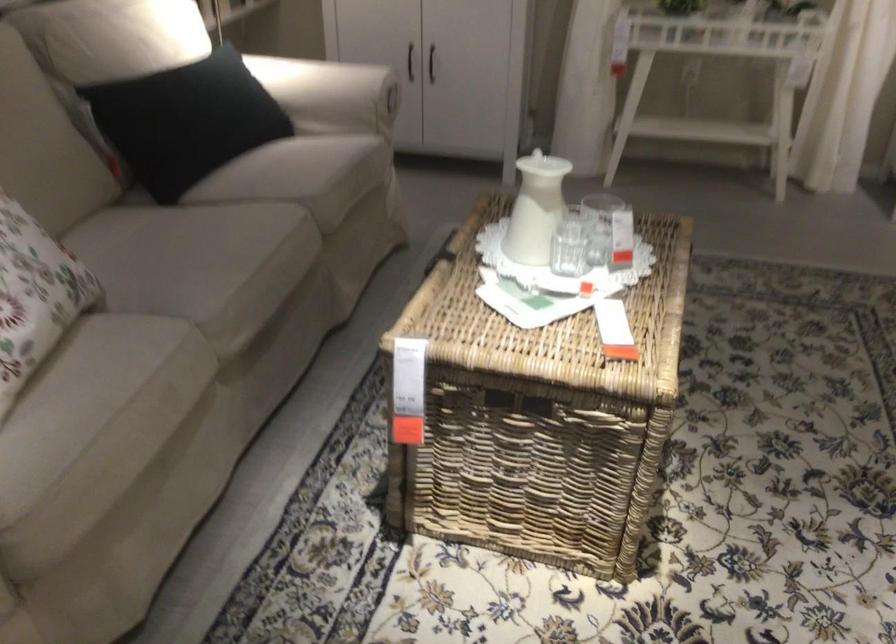
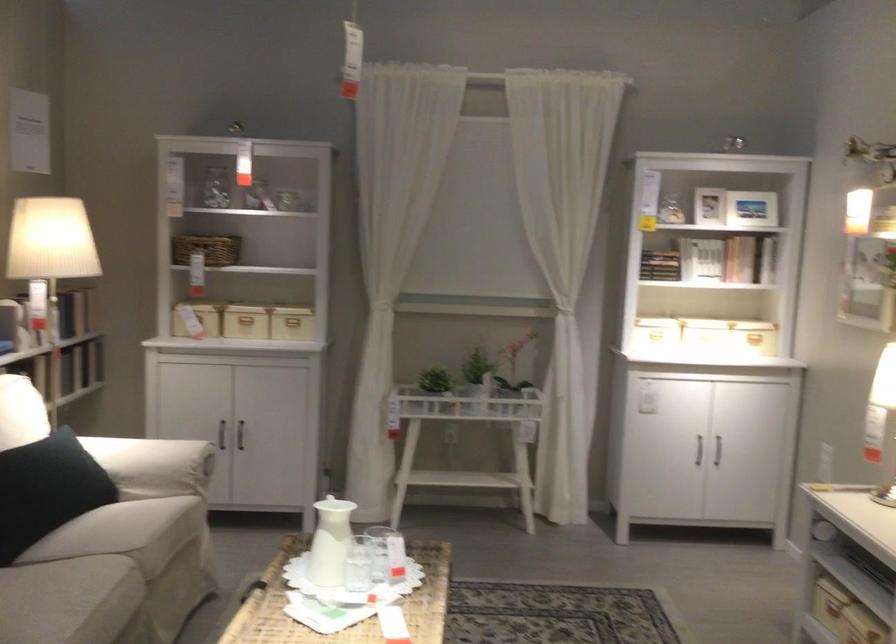
Find the pixel in the second image that matches point 526,201 in the first image.

(330, 542)